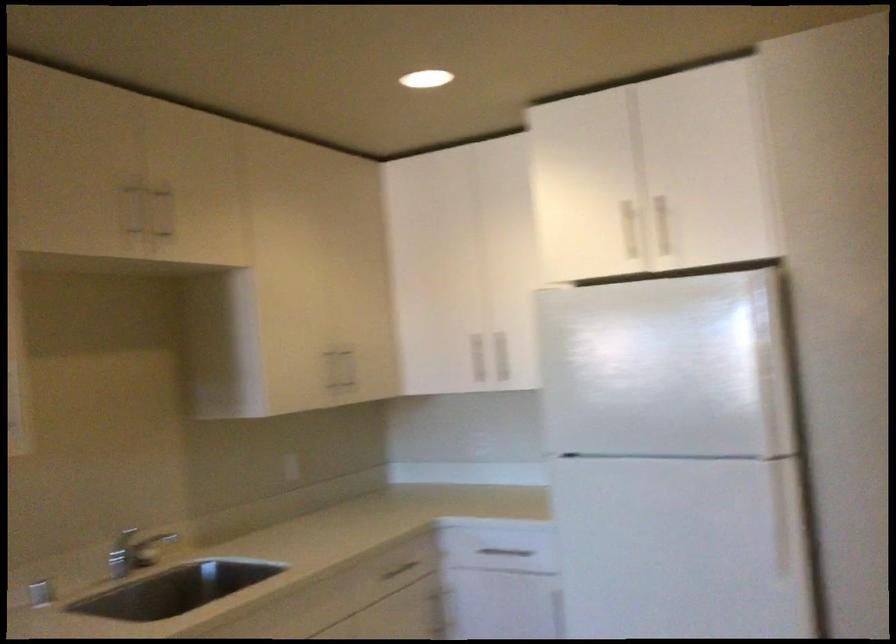
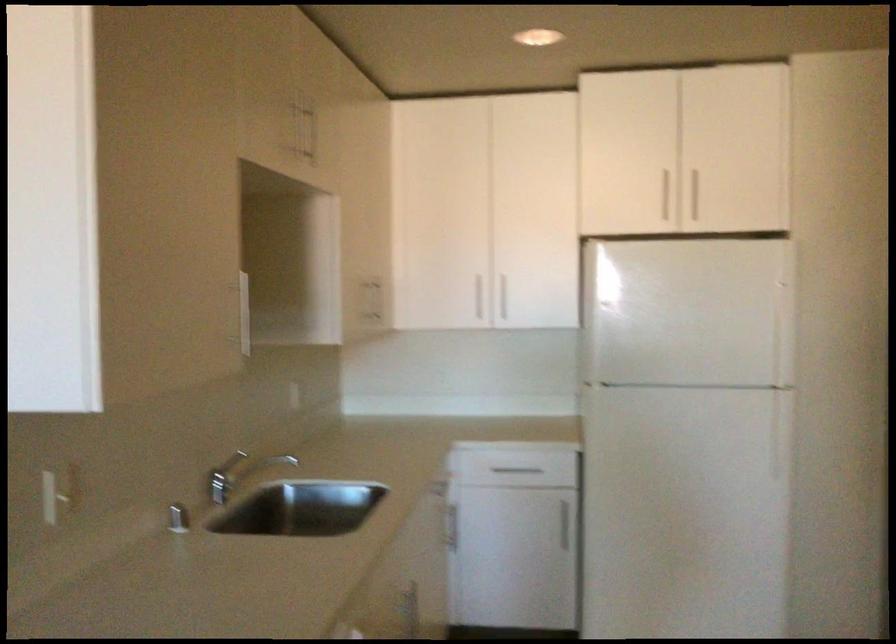
Find the pixel in the second image that matches point (216, 543) in the first image.

(263, 467)